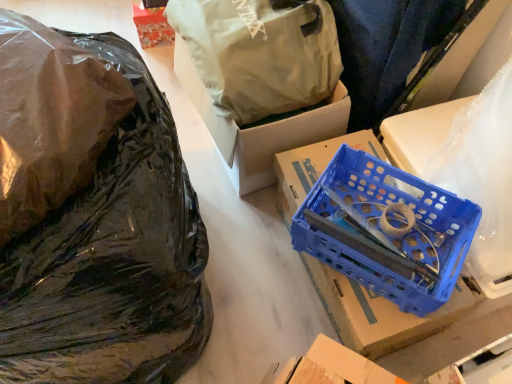
Question: From a real-world perspective, is matte white plastic bag at upper center, which ranks as the 1th plastic bag in top-to-bottom order, above or below white cardboard box at upper center, the 2th box viewed from the front?

Choices:
 (A) above
 (B) below

Answer: (A)

Question: Is point (226, 41) closer or farther from the camera than point (291, 119)?

Choices:
 (A) farther
 (B) closer

Answer: (B)

Question: Which object is positioned closest to the blue plastic crate at center-right, placed as the 2th box when sorted from back to front?

Choices:
 (A) matte white plastic bag at upper center, which is the 3th plastic bag in bottom-to-top order
 (B) transparent plastic bag at left, which appears as the second plastic bag when ordered from the bottom
 (C) black plastic bag at left, which ranks as the 3th plastic bag in top-to-bottom order
 (D) white cardboard box at upper center, placed as the first box when sorted from back to front

Answer: (D)

Question: Considering the real-world distances, which object is closest to the black plastic bag at left, positioned as the 1th plastic bag in bottom-to-top order?

Choices:
 (A) blue plastic crate at center-right, placed as the 2th box when sorted from back to front
 (B) transparent plastic bag at left, placed as the second plastic bag when sorted from top to bottom
 (C) matte white plastic bag at upper center, which is the 3th plastic bag in bottom-to-top order
 (D) white cardboard box at upper center, the 2th box viewed from the front

Answer: (B)